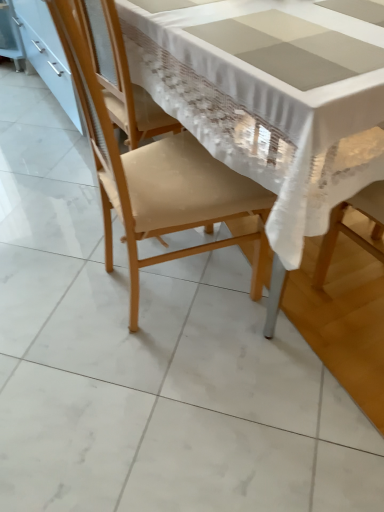
Question: From the image's perspective, is white glossy cabinet at left under white lace tablecloth at center?

Choices:
 (A) no
 (B) yes

Answer: (A)

Question: Considering the relative sizes of white glossy cabinet at left and white lace tablecloth at center in the image provided, is white glossy cabinet at left bigger than white lace tablecloth at center?

Choices:
 (A) yes
 (B) no

Answer: (B)

Question: Does white glossy cabinet at left have a greater width compared to white lace tablecloth at center?

Choices:
 (A) yes
 (B) no

Answer: (B)

Question: Does white glossy cabinet at left appear on the right side of white lace tablecloth at center?

Choices:
 (A) no
 (B) yes

Answer: (A)

Question: From the image's perspective, is white glossy cabinet at left located above white lace tablecloth at center?

Choices:
 (A) yes
 (B) no

Answer: (A)

Question: Is white glossy cabinet at left at the left side of white lace tablecloth at center?

Choices:
 (A) no
 (B) yes

Answer: (B)

Question: Is white glossy cabinet at left located within white lace tablecloth at center?

Choices:
 (A) yes
 (B) no

Answer: (B)

Question: Is white lace tablecloth at center smaller than white glossy cabinet at left?

Choices:
 (A) yes
 (B) no

Answer: (B)

Question: Considering the relative positions of white lace tablecloth at center and white glossy cabinet at left in the image provided, is white lace tablecloth at center to the left of white glossy cabinet at left from the viewer's perspective?

Choices:
 (A) no
 (B) yes

Answer: (A)

Question: Is white lace tablecloth at center behind white glossy cabinet at left?

Choices:
 (A) no
 (B) yes

Answer: (A)

Question: Considering the relative positions of white lace tablecloth at center and white glossy cabinet at left in the image provided, is white lace tablecloth at center to the right of white glossy cabinet at left from the viewer's perspective?

Choices:
 (A) no
 (B) yes

Answer: (B)

Question: From a real-world perspective, is white lace tablecloth at center beneath white glossy cabinet at left?

Choices:
 (A) no
 (B) yes

Answer: (A)

Question: From the image's perspective, is matte beige chair at center on top of white lace tablecloth at center?

Choices:
 (A) yes
 (B) no

Answer: (B)